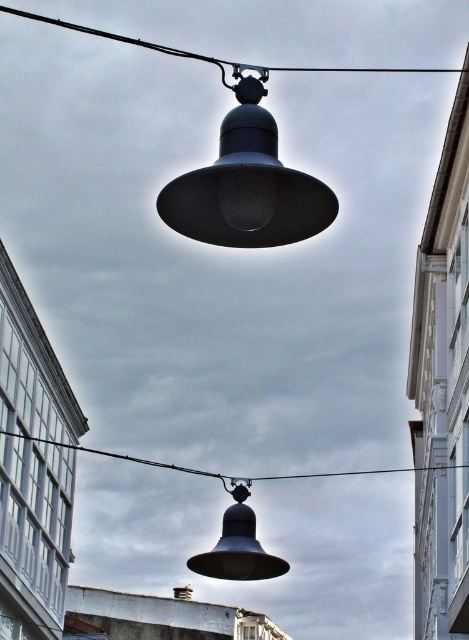
You are standing at the point marked as point [266,554] and want to take a photo of the two industrial lamps. Since the camera can only focus on objects within 100 feet, will the lamps be in focus?

The distance of point [266,554] from camera is 108.85 feet, which is beyond the camera focus range of 100 feet. Therefore, the lamps will not be in focus.

You are a maintenance worker who needs to reach the matte black bell at lower center and the black wire at center. Given that you can only carry tools up to 150 meters in length, can you safely use a ladder to reach both objects without exceeding your tool length limit?

The distance between the matte black bell at lower center and the black wire at center is 143.89 meters. Since your ladder length limit is 150 meters, you can safely use a ladder to reach both objects as the distance is within the allowed limit.

You are a maintenance worker inspecting the lamps. You notice the matte black lamp at upper center and the black wire at center. Which object is positioned nearer to you?

The matte black lamp at upper center is closer to the viewer than the black wire at center.